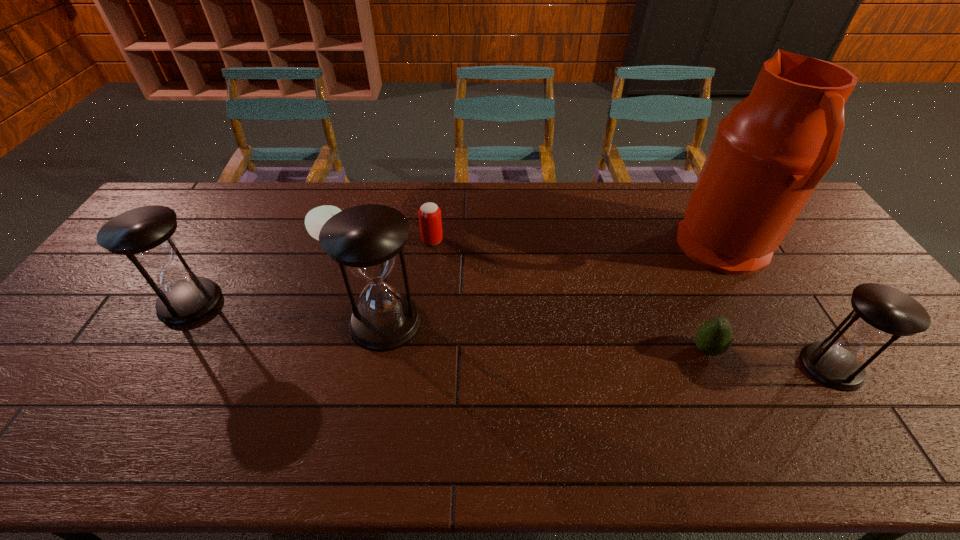
Locate an element on the screen. The height and width of the screenshot is (540, 960). free point that satisfies the following two spatial constraints: 1. on the front side of the second hourglass from right to left; 2. on the left side of the second object from left to right is located at coordinates (300, 321).